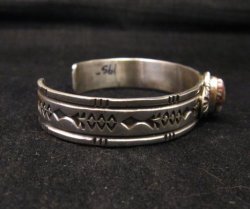
At what (x,y) coordinates should I click in order to perform the action: click on granite surface. Please return your answer as a coordinate pair (x, y). Looking at the image, I should click on (147, 171).